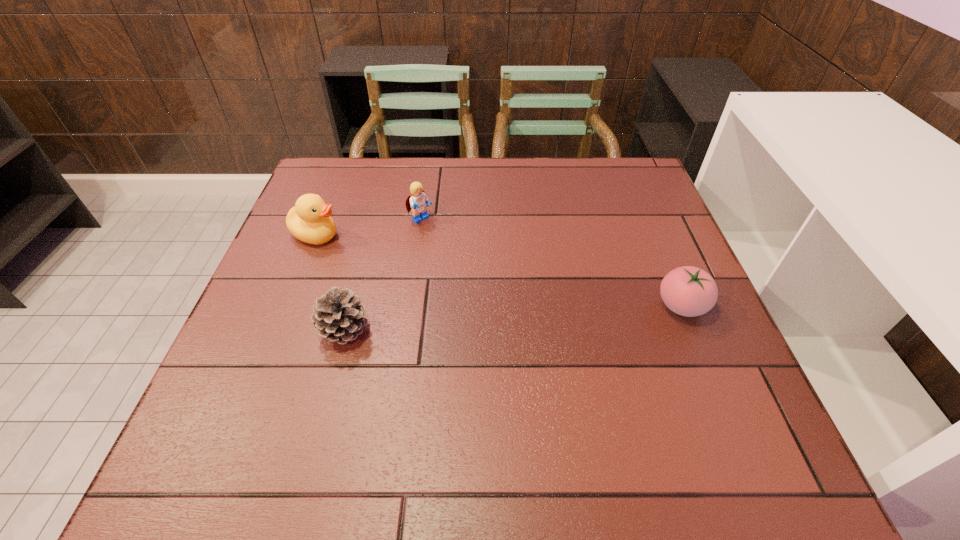
The height and width of the screenshot is (540, 960). Find the location of `free spot on the desktop that is between the pinecone and the rightmost object and is positioned at the beak of the leftmost object`. free spot on the desktop that is between the pinecone and the rightmost object and is positioned at the beak of the leftmost object is located at coordinates (528, 317).

You are a GUI agent. You are given a task and a screenshot of the screen. Output one action in this format:
    pyautogui.click(x=<x>, y=<y>)
    Task: Click on the vacant space on the desktop that is between the pinecone and the rightmost object and is positioned on the front-facing side of the second object from right to left
    
    Given the screenshot: What is the action you would take?
    pyautogui.click(x=535, y=316)